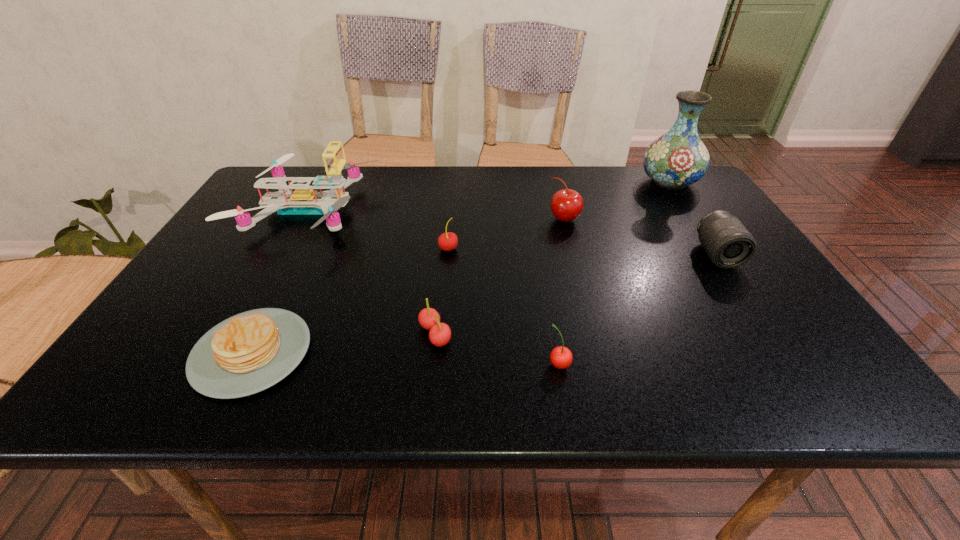
I want to click on cherry that is positioned at the near edge, so (x=561, y=357).

What are the coordinates of `pancake that is at the near edge` in the screenshot? It's located at (247, 353).

Where is `drone at the left edge`? The width and height of the screenshot is (960, 540). drone at the left edge is located at coordinates (304, 200).

You are a GUI agent. You are given a task and a screenshot of the screen. Output one action in this format:
    pyautogui.click(x=<x>, y=<y>)
    Task: Click on the pancake present at the left edge
    The image size is (960, 540).
    Given the screenshot: What is the action you would take?
    pyautogui.click(x=247, y=353)

This screenshot has height=540, width=960. I want to click on vase at the right edge, so click(678, 158).

Identify the location of telephoto lens present at the right edge. Image resolution: width=960 pixels, height=540 pixels. (727, 242).

The width and height of the screenshot is (960, 540). In order to click on object located at the far left corner in this screenshot , I will do `click(304, 200)`.

The height and width of the screenshot is (540, 960). I want to click on object located at the near left corner, so coord(247,353).

You are a GUI agent. You are given a task and a screenshot of the screen. Output one action in this format:
    pyautogui.click(x=<x>, y=<y>)
    Task: Click on the object that is at the far right corner
    Image resolution: width=960 pixels, height=540 pixels.
    Given the screenshot: What is the action you would take?
    pyautogui.click(x=678, y=158)

This screenshot has width=960, height=540. I want to click on vacant area at the far edge of the desktop, so click(506, 170).